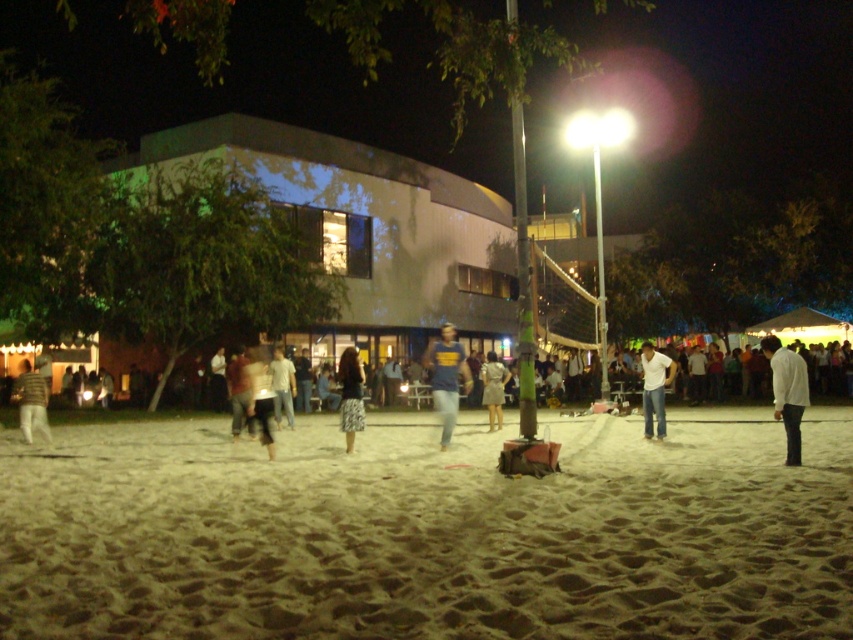
You are a photographer trying to capture the entire beach volleyball court at night. The camera you are using has a sensor that can only capture objects within a 0.8 radius from the center. Given that the point marking beige sand at center is located at coordinates point (428, 532), will the beige sand at center be within the camera sensor range?

The point marking beige sand at center is located at coordinates point (428, 532). Since the camera sensor can capture objects within a 0.8 radius from the center, the distance from the center to the point is sqrt 0.833 squared plus 0.504 squared equals approximately 0.972, which is greater than 0.8. Therefore, the beige sand at center will not be within the camera sensor range.

From the picture: You are standing at the center of the image and want to move towards the point marked at coordinates (350, 396). What object will you be approaching?

The point at coordinates (350, 396) is on the patterned fabric skirt at center, so moving towards it would lead you to the patterned fabric skirt at center.

You are standing at the center of the volleyball court and want to find the striped sweater at left. According to the coordinates provided, in which direction should you look to locate it?

The striped sweater at left is located at coordinates point [32,403], which corresponds to the left side of the image. Therefore, you should look to your left to locate it.